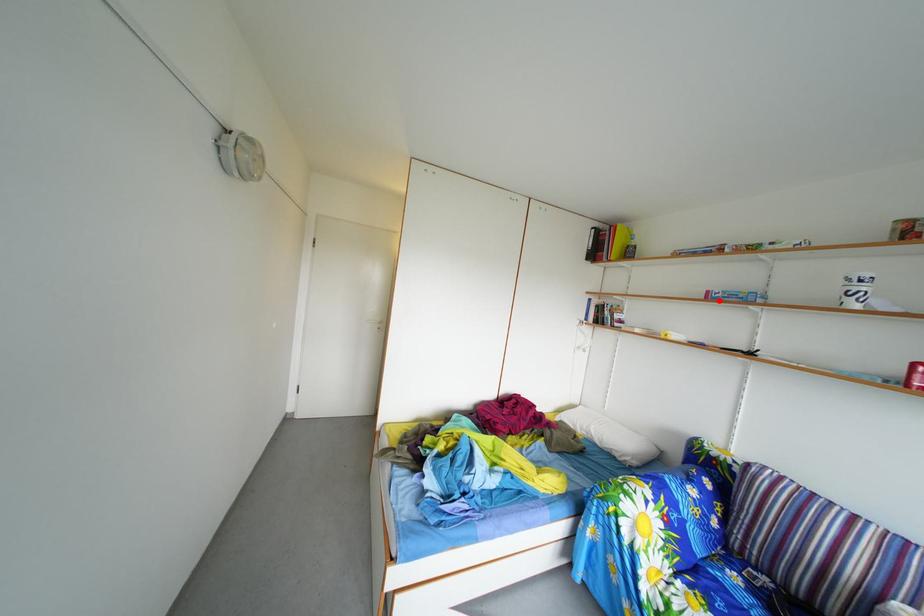
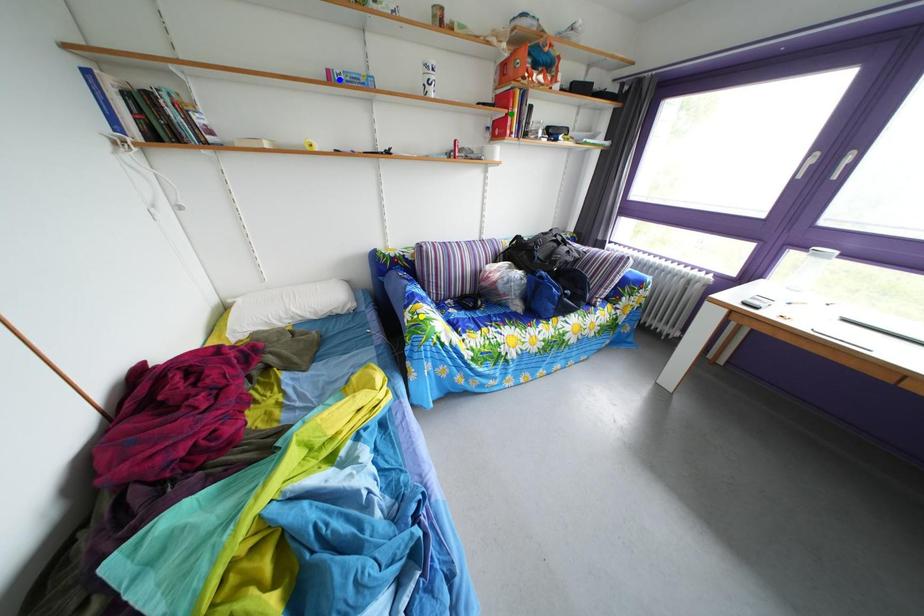
Question: I am providing you with two images of the same scene from different viewpoints. A red point is marked on the first image. You are given multiple points on the second image. Which point in image 2 is actually the same real-world point as the red point in image 1?

Choices:
 (A) green point
 (B) yellow point
 (C) blue point

Answer: (C)